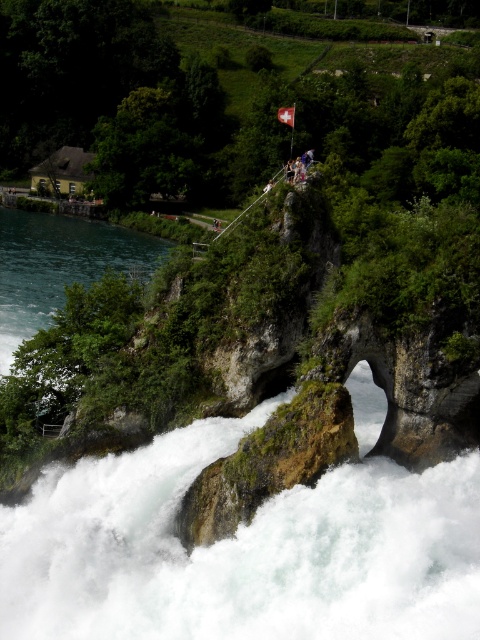
Question: Among these objects, which one is farthest from the camera?

Choices:
 (A) greenish-blue water at left
 (B) white fabric flag at center
 (C) white frothy water at center

Answer: (B)

Question: Is white frothy water at center positioned at the back of greenish-blue water at left?

Choices:
 (A) yes
 (B) no

Answer: (B)

Question: Which of the following is the closest to the observer?

Choices:
 (A) (286, 113)
 (B) (132, 241)
 (C) (410, 474)

Answer: (C)

Question: Does greenish-blue water at left appear on the left side of white fabric flag at center?

Choices:
 (A) no
 (B) yes

Answer: (B)

Question: Which is nearer to the white frothy water at center?

Choices:
 (A) white fabric flag at center
 (B) greenish-blue water at left

Answer: (B)

Question: Does white frothy water at center have a greater width compared to greenish-blue water at left?

Choices:
 (A) no
 (B) yes

Answer: (A)